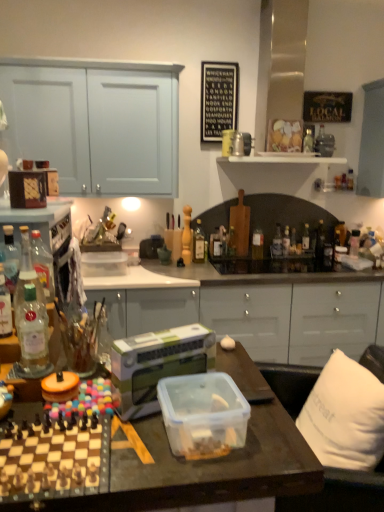
Question: Does clear glass bottle at center, which is the 3th bottle in back-to-front order, have a larger size compared to clear glass bottle at right, the 1th bottle when ordered from back to front?

Choices:
 (A) yes
 (B) no

Answer: (A)

Question: Does clear glass bottle at center, which appears as the eleventh bottle when viewed from the front, touch clear glass bottle at right, the 1th bottle when ordered from back to front?

Choices:
 (A) no
 (B) yes

Answer: (A)

Question: Would you say clear glass bottle at right, placed as the 12th bottle when sorted from left to right, is part of clear glass bottle at center, which ranks as the ninth bottle in left-to-right order,'s contents?

Choices:
 (A) yes
 (B) no

Answer: (B)

Question: From a real-world perspective, is clear glass bottle at center, which ranks as the ninth bottle in left-to-right order, under clear glass bottle at right, placed as the 12th bottle when sorted from left to right?

Choices:
 (A) no
 (B) yes

Answer: (B)

Question: Can you confirm if clear glass bottle at center, marked as the 5th bottle in a right-to-left arrangement, is shorter than clear glass bottle at right, the 13th bottle positioned from the front?

Choices:
 (A) no
 (B) yes

Answer: (A)

Question: Is clear glass bottle at center, which ranks as the ninth bottle in left-to-right order, not within clear glass bottle at right, the 13th bottle positioned from the front?

Choices:
 (A) yes
 (B) no

Answer: (A)

Question: Can you confirm if translucent glass bottle at center, which ranks as the 6th bottle in right-to-left order, is shorter than translucent glass bottle at center, the ninth bottle viewed from the back?

Choices:
 (A) yes
 (B) no

Answer: (A)

Question: Does translucent glass bottle at center, arranged as the 9th bottle when viewed from the front, have a greater width compared to translucent glass bottle at center, which is the tenth bottle in right-to-left order?

Choices:
 (A) yes
 (B) no

Answer: (A)

Question: Is translucent glass bottle at center, which ranks as the 6th bottle in right-to-left order, outside translucent glass bottle at center, which appears as the fourth bottle when viewed from the left?

Choices:
 (A) yes
 (B) no

Answer: (A)

Question: Is translucent glass bottle at center, which ranks as the 6th bottle in right-to-left order, bigger than translucent glass bottle at center, which appears as the fourth bottle when viewed from the left?

Choices:
 (A) yes
 (B) no

Answer: (A)

Question: Considering the relative positions of translucent glass bottle at center, arranged as the 9th bottle when viewed from the front, and translucent glass bottle at center, the 5th bottle in the front-to-back sequence, in the image provided, is translucent glass bottle at center, arranged as the 9th bottle when viewed from the front, to the left of translucent glass bottle at center, the 5th bottle in the front-to-back sequence, from the viewer's perspective?

Choices:
 (A) no
 (B) yes

Answer: (A)

Question: Does translucent glass bottle at center, positioned as the 8th bottle in left-to-right order, lie behind translucent glass bottle at center, the ninth bottle viewed from the back?

Choices:
 (A) no
 (B) yes

Answer: (B)

Question: From the image's perspective, is translucent glass bottle at center, positioned as the 5th bottle in back-to-front order, below orange plastic lid at center, marked as the 2th appliance in a right-to-left arrangement?

Choices:
 (A) no
 (B) yes

Answer: (A)